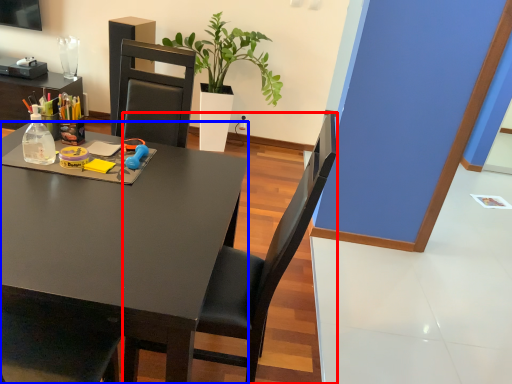
Question: Which point is closer to the camera, chair (highlighted by a red box) or desk (highlighted by a blue box)?

Choices:
 (A) chair
 (B) desk

Answer: (B)